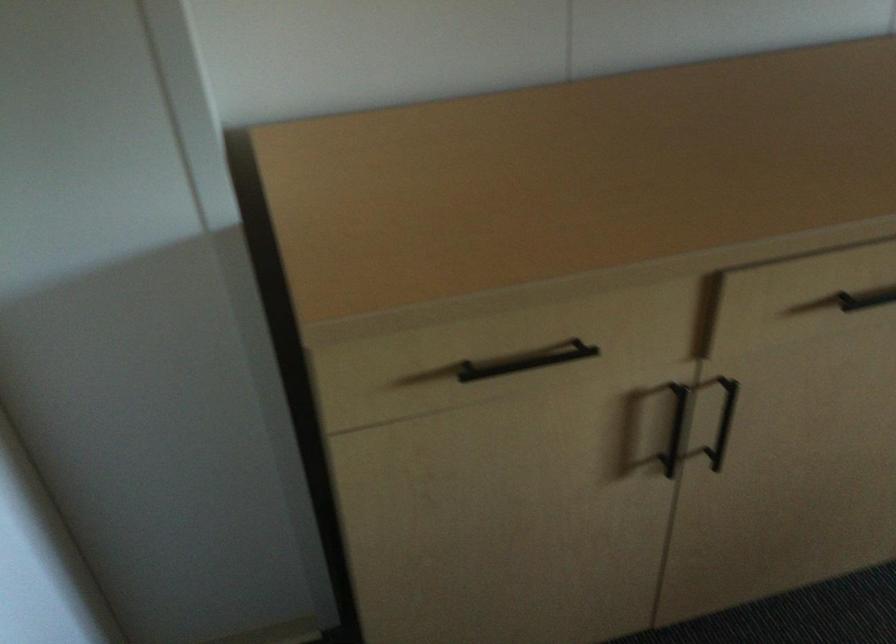
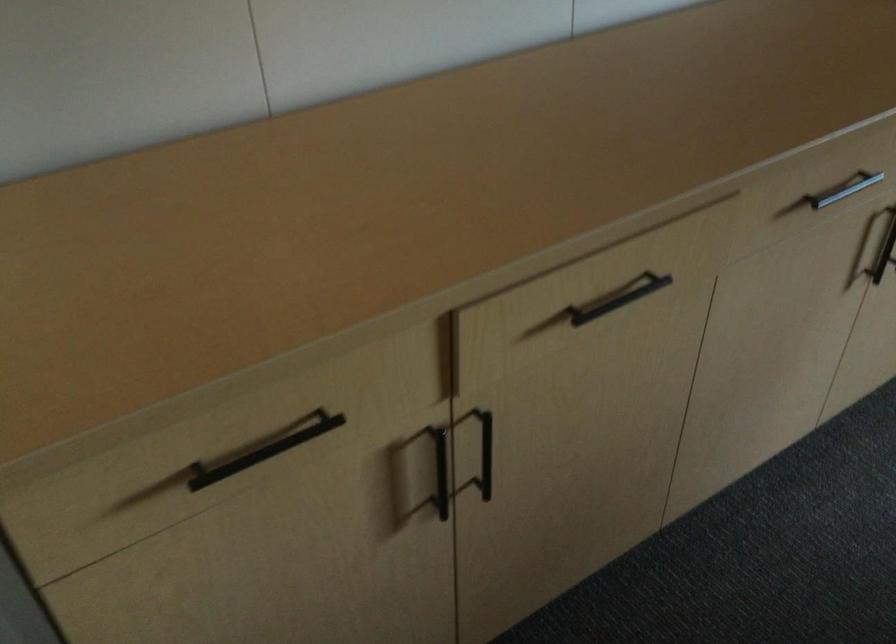
Question: The images are taken continuously from a first-person perspective. In which direction is your viewpoint rotating?

Choices:
 (A) Left
 (B) Right
 (C) Up
 (D) Down

Answer: (B)